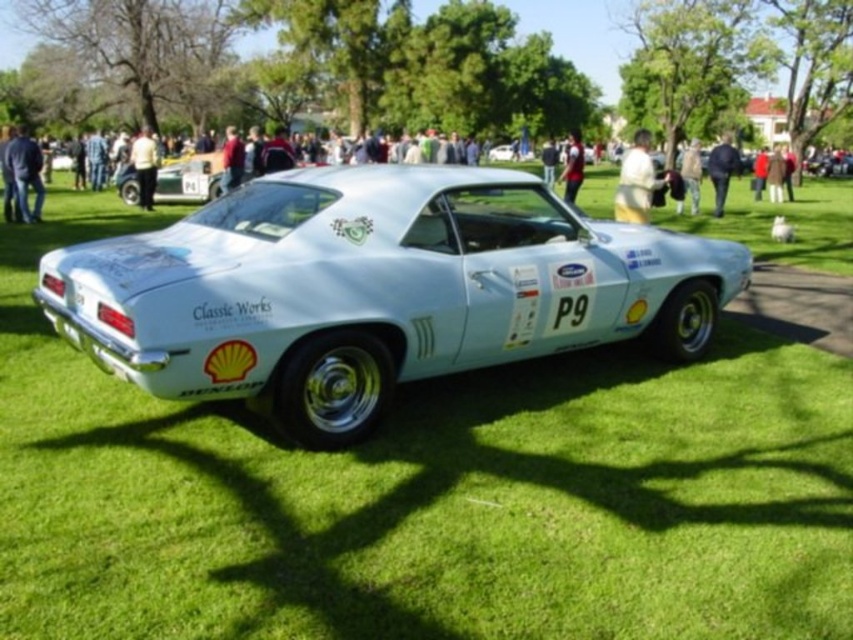
Can you confirm if white shirt at center is taller than red sweater at upper center?

Yes, white shirt at center is taller than red sweater at upper center.

Can you confirm if white shirt at center is shorter than red sweater at upper center?

No.

Is point (140, 188) in front of point (229, 164)?

No, it is behind (229, 164).

What are the coordinates of `white shirt at center` in the screenshot? It's located at (144, 166).

Is white fabric shirt at upper center to the left of white shirt at center from the viewer's perspective?

Incorrect, white fabric shirt at upper center is not on the left side of white shirt at center.

Where is `white fabric shirt at upper center`? The width and height of the screenshot is (853, 640). white fabric shirt at upper center is located at coordinates (636, 180).

Is point (627, 195) farther from viewer compared to point (143, 200)?

That is False.

The height and width of the screenshot is (640, 853). Identify the location of white fabric shirt at upper center. (636, 180).

How distant is white fabric shirt at upper center from light blue fabric jacket at center?

white fabric shirt at upper center is 8.26 meters away from light blue fabric jacket at center.

This screenshot has width=853, height=640. What are the coordinates of `white fabric shirt at upper center` in the screenshot? It's located at (636, 180).

You are a GUI agent. You are given a task and a screenshot of the screen. Output one action in this format:
    pyautogui.click(x=<x>, y=<y>)
    Task: Click on the white fabric shirt at upper center
    The height and width of the screenshot is (640, 853).
    Given the screenshot: What is the action you would take?
    coord(636,180)